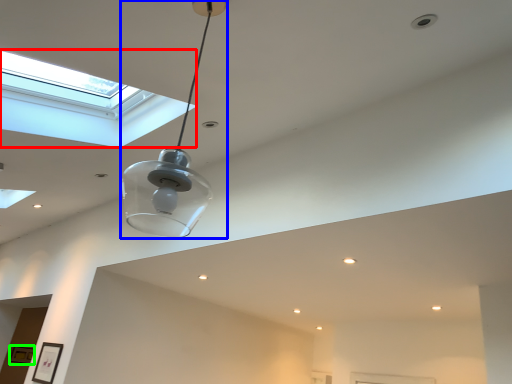
Question: Based on their relative distances, which object is farther from window (highlighted by a red box)? Choose from lamp (highlighted by a blue box) and picture frame (highlighted by a green box).

Choices:
 (A) lamp
 (B) picture frame

Answer: (B)